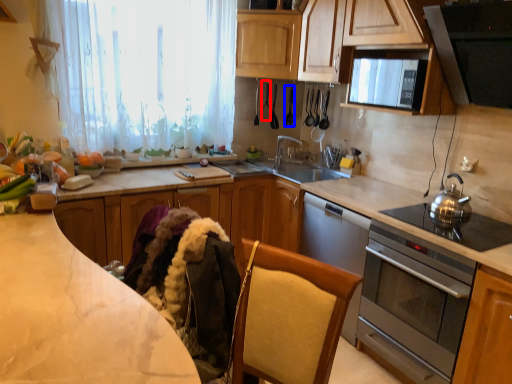
Question: Which of the following is the closest to the observer, appliance (highlighted by a red box) or appliance (highlighted by a blue box)?

Choices:
 (A) appliance
 (B) appliance

Answer: (B)